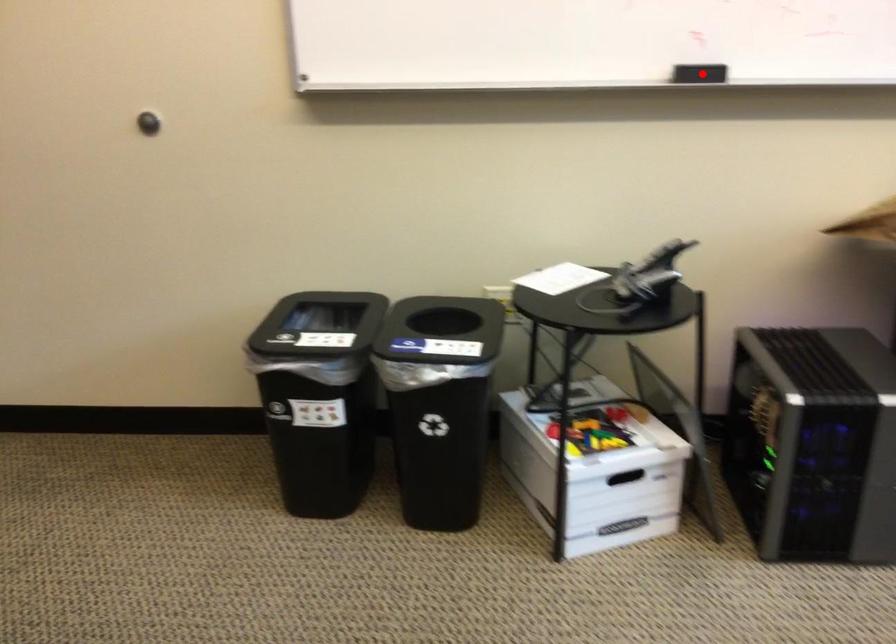
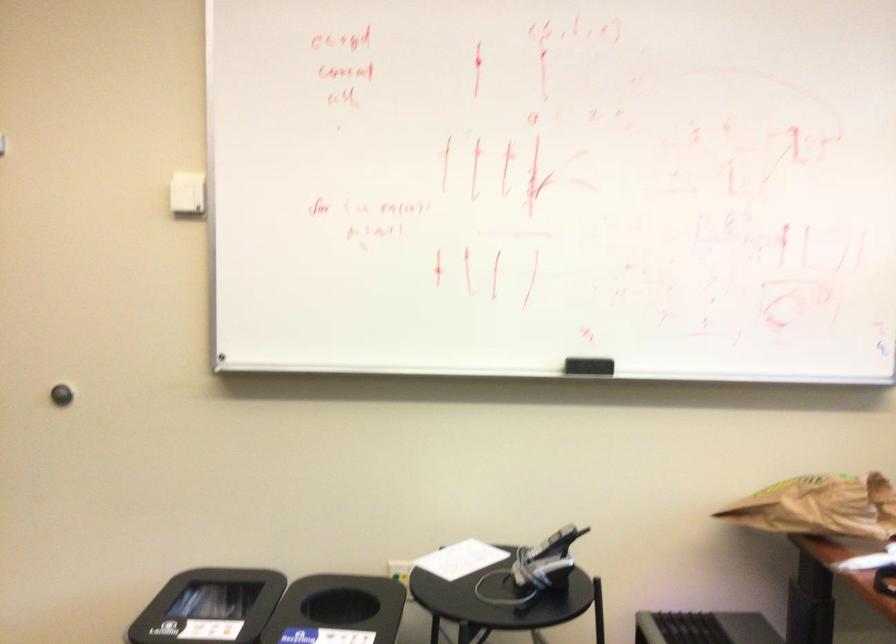
Where in the second image is the point corresponding to the highlighted location from the first image?

(588, 366)